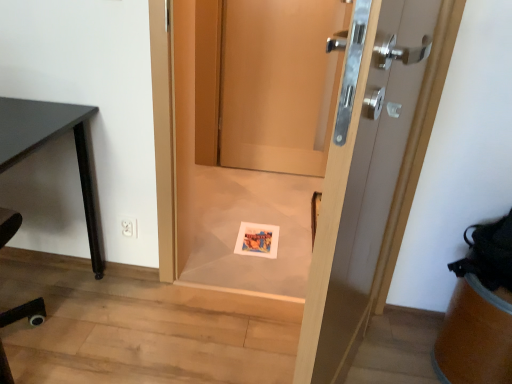
Where is `blank space situated above matte paper postcard at center (from a real-world perspective)`? Image resolution: width=512 pixels, height=384 pixels. blank space situated above matte paper postcard at center (from a real-world perspective) is located at coordinates (254, 231).